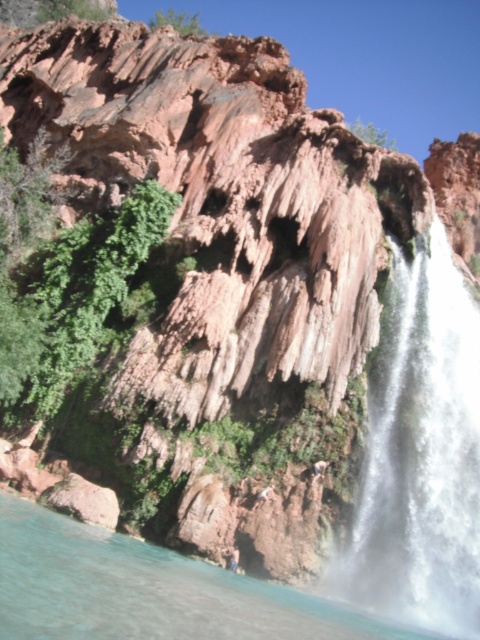
Question: Which object is the closest to the clear blue water at lower left?

Choices:
 (A) white frothy water at right
 (B) light brown skin at lower center
 (C) brown textured rock at center

Answer: (C)

Question: Which of the following is the farthest from the observer?

Choices:
 (A) (264, 500)
 (B) (313, 465)

Answer: (B)

Question: Among these points, which one is farthest from the camera?

Choices:
 (A) (0, 560)
 (B) (325, 468)
 (C) (271, 493)
 (D) (442, 369)

Answer: (D)

Question: Is clear blue water at lower left bigger than brown textured rock at center?

Choices:
 (A) no
 (B) yes

Answer: (B)

Question: Can you confirm if white frothy water at right is positioned to the left of brown textured rock at center?

Choices:
 (A) no
 (B) yes

Answer: (A)

Question: Is brown textured rock at center smaller than light brown skin at lower center?

Choices:
 (A) no
 (B) yes

Answer: (A)